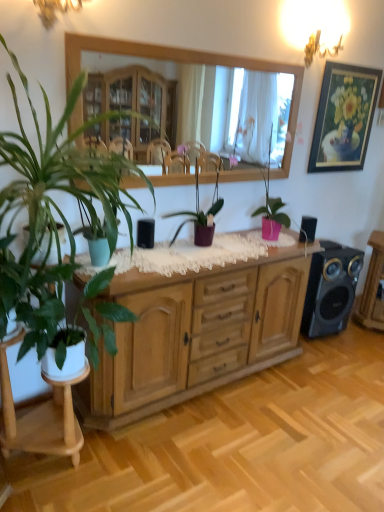
Question: Can we say black matte speaker at center, placed as the 3th speaker when sorted from back to front, lies outside white lace cloth at center?

Choices:
 (A) yes
 (B) no

Answer: (A)

Question: Is black matte speaker at center, the first speaker from the left, further to the viewer compared to white lace cloth at center?

Choices:
 (A) yes
 (B) no

Answer: (A)

Question: From the image's perspective, does black matte speaker at center, the first speaker from the left, appear lower than white lace cloth at center?

Choices:
 (A) yes
 (B) no

Answer: (B)

Question: Is black matte speaker at center, marked as the 1th speaker in a front-to-back arrangement, taller than white lace cloth at center?

Choices:
 (A) yes
 (B) no

Answer: (A)

Question: Is black matte speaker at center, marked as the 1th speaker in a front-to-back arrangement, turned away from white lace cloth at center?

Choices:
 (A) no
 (B) yes

Answer: (A)

Question: From a real-world perspective, is black matte speaker at center, marked as the 1th speaker in a front-to-back arrangement, beneath white lace cloth at center?

Choices:
 (A) no
 (B) yes

Answer: (A)

Question: Are pink matte plant at center, which ranks as the 4th houseplant in left-to-right order, and gold-framed painting at upper right beside each other?

Choices:
 (A) yes
 (B) no

Answer: (B)

Question: Is gold-framed painting at upper right located within pink matte plant at center, which ranks as the 4th houseplant in left-to-right order?

Choices:
 (A) yes
 (B) no

Answer: (B)

Question: Can you confirm if pink matte plant at center, which is the 1th houseplant in right-to-left order, is bigger than gold-framed painting at upper right?

Choices:
 (A) no
 (B) yes

Answer: (B)

Question: From the image's perspective, would you say pink matte plant at center, which ranks as the 4th houseplant in left-to-right order, is shown under gold-framed painting at upper right?

Choices:
 (A) no
 (B) yes

Answer: (B)

Question: Is the depth of pink matte plant at center, which is the 1th houseplant in right-to-left order, greater than that of gold-framed painting at upper right?

Choices:
 (A) no
 (B) yes

Answer: (A)

Question: Is pink matte plant at center, which is the 1th houseplant in right-to-left order, shorter than gold-framed painting at upper right?

Choices:
 (A) no
 (B) yes

Answer: (B)

Question: Is there a large distance between metallic gold chandelier at upper right, which is counted as the 2th lamp, starting from the left, and black matte speaker at center, marked as the 1th speaker in a front-to-back arrangement?

Choices:
 (A) no
 (B) yes

Answer: (B)